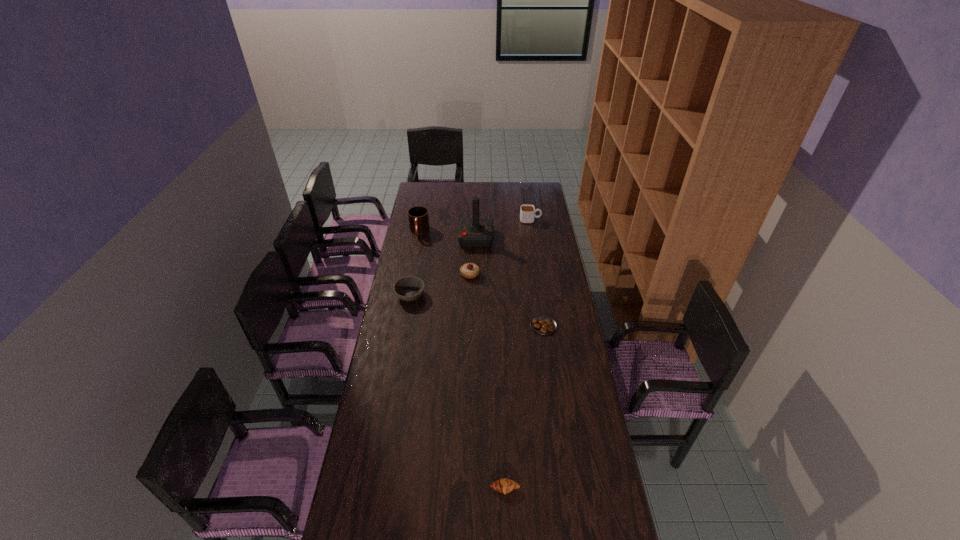
This screenshot has height=540, width=960. Identify the location of pastry that is positioned at the right edge. (541, 324).

The width and height of the screenshot is (960, 540). What are the coordinates of `free space at the far edge of the desktop` in the screenshot? It's located at (442, 197).

Image resolution: width=960 pixels, height=540 pixels. What are the coordinates of `vacant space at the left edge of the desktop` in the screenshot? It's located at (343, 519).

Find the location of a particular element. This screenshot has width=960, height=540. vacant space at the right edge of the desktop is located at coordinates (528, 242).

Locate an element on the screen. The image size is (960, 540). vacant region at the far left corner of the desktop is located at coordinates (418, 188).

Where is `vacant area that lies between the nearest pastry and the cup`? The image size is (960, 540). vacant area that lies between the nearest pastry and the cup is located at coordinates (517, 354).

Locate an element on the screen. vacant region between the cup and the nearest pastry is located at coordinates (517, 354).

You are a GUI agent. You are given a task and a screenshot of the screen. Output one action in this format:
    pyautogui.click(x=<x>, y=<y>)
    Task: Click on the vacant space that is in between the fourth shortest object and the second pastry from left to right
    
    Given the screenshot: What is the action you would take?
    click(x=488, y=381)

Locate an element on the screen. vacant area that lies between the joystick and the sixth farthest object is located at coordinates (510, 282).

Where is `vacant space that's between the sixth shortest object and the second nearest object`? This screenshot has height=540, width=960. vacant space that's between the sixth shortest object and the second nearest object is located at coordinates (481, 279).